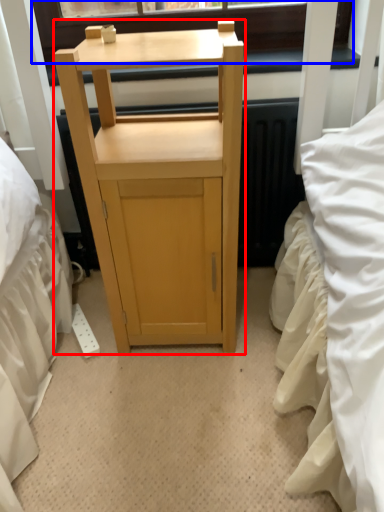
Question: Which object is closer to the camera taking this photo, furniture (highlighted by a red box) or window screen (highlighted by a blue box)?

Choices:
 (A) furniture
 (B) window screen

Answer: (A)